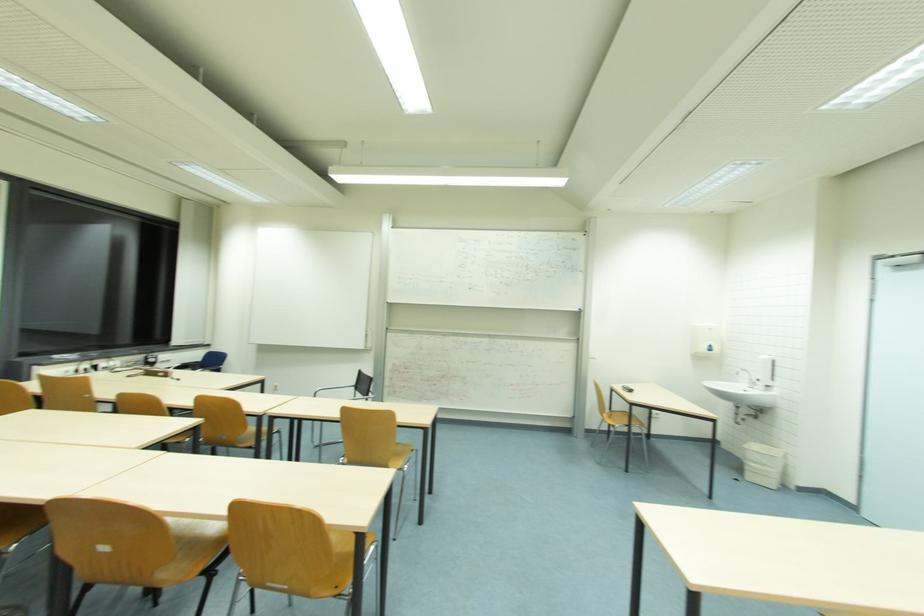
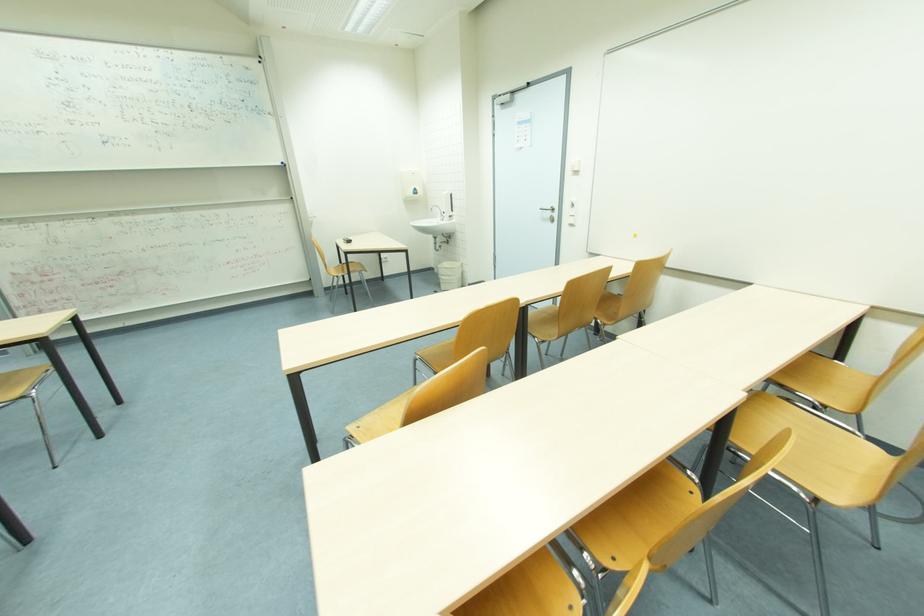
Based on the continuous images, in which direction is the camera rotating?

The camera's rotation is toward right-down.